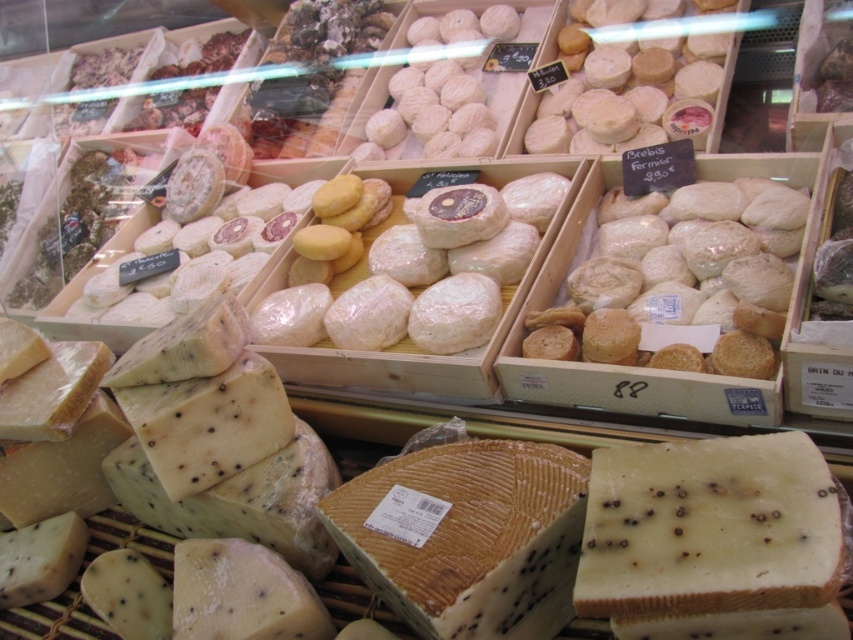
Question: Among these objects, which one is nearest to the camera?

Choices:
 (A) blue veined cheese at center
 (B) white crumbly cheese at center

Answer: (B)

Question: Which point is closer to the camera?

Choices:
 (A) (607, 337)
 (B) (624, 582)
 (C) (379, 481)

Answer: (B)

Question: Does white crumbly cheese at center appear on the left side of white crumbly bread at center?

Choices:
 (A) no
 (B) yes

Answer: (B)

Question: Which of the following is the farthest from the observer?

Choices:
 (A) (627, 337)
 (B) (549, 596)

Answer: (A)

Question: Is white crumbly cheese at center to the left of blue veined cheese at center from the viewer's perspective?

Choices:
 (A) yes
 (B) no

Answer: (B)

Question: Where is white crumbly bread at center located in relation to blue veined cheese at center in the image?

Choices:
 (A) above
 (B) below

Answer: (A)